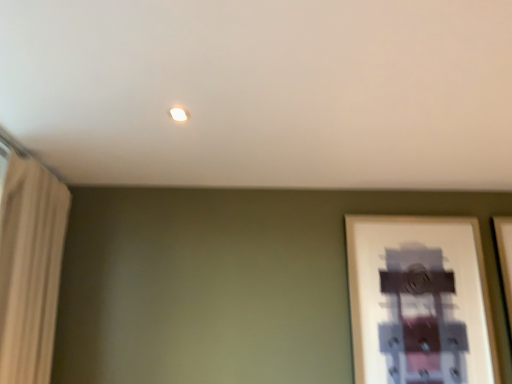
Describe the element at coordinates (30, 268) in the screenshot. I see `beige fabric curtain at left` at that location.

Identify the location of beige fabric curtain at left. (30, 268).

You are a GUI agent. You are given a task and a screenshot of the screen. Output one action in this format:
    pyautogui.click(x=<x>, y=<y>)
    Task: Click on the beige fabric curtain at left
    
    Given the screenshot: What is the action you would take?
    pyautogui.click(x=30, y=268)